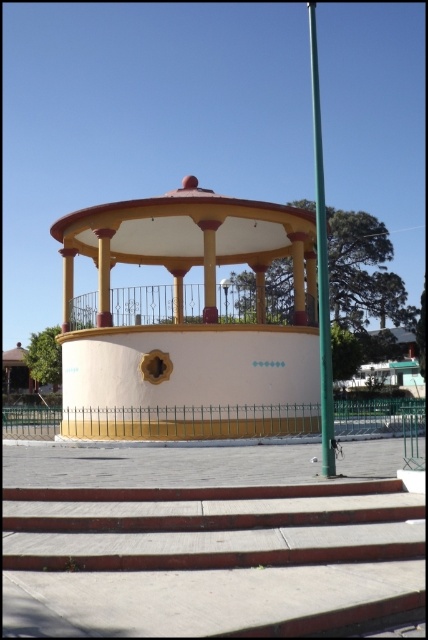
Who is lower down, matte yellow gazebo at center or green metallic pole at right?

Positioned lower is matte yellow gazebo at center.

Is matte yellow gazebo at center wider than green metallic pole at right?

No.

Does point (259, 342) come farther from viewer compared to point (327, 285)?

Yes, it is.

In order to click on matte yellow gazebo at center in this screenshot , I will do `click(190, 323)`.

Which is above, concrete steps at center or green metallic pole at right?

Positioned higher is green metallic pole at right.

Describe the element at coordinates (211, 560) in the screenshot. The width and height of the screenshot is (428, 640). I see `concrete steps at center` at that location.

Is point (261, 490) positioned in front of point (315, 148)?

Yes, it is in front of point (315, 148).

The width and height of the screenshot is (428, 640). What are the coordinates of `concrete steps at center` in the screenshot? It's located at (211, 560).

Does concrete steps at center appear on the right side of matte yellow gazebo at center?

Correct, you'll find concrete steps at center to the right of matte yellow gazebo at center.

Find the location of `concrete steps at center`. concrete steps at center is located at coordinates (211, 560).

Identify the location of concrete steps at center. The width and height of the screenshot is (428, 640). (211, 560).